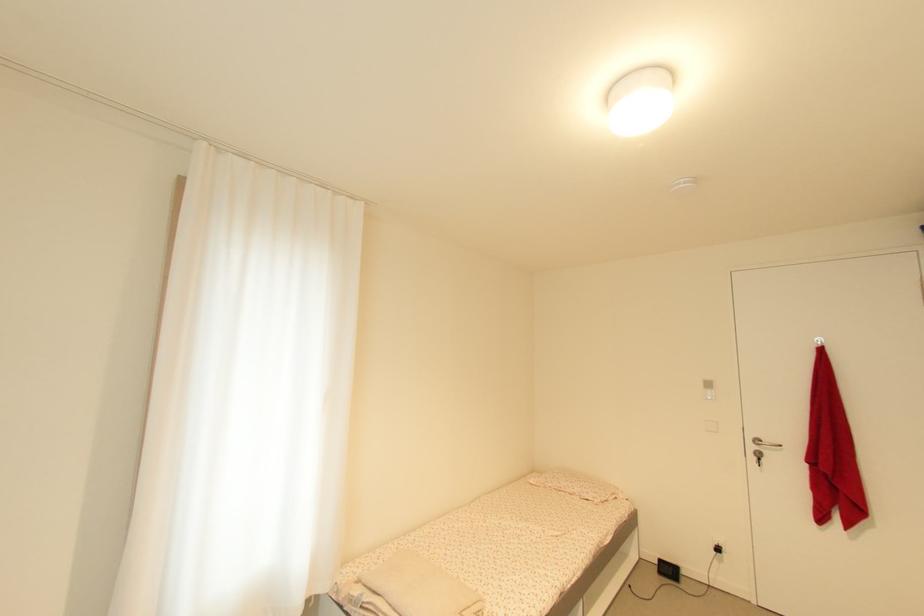
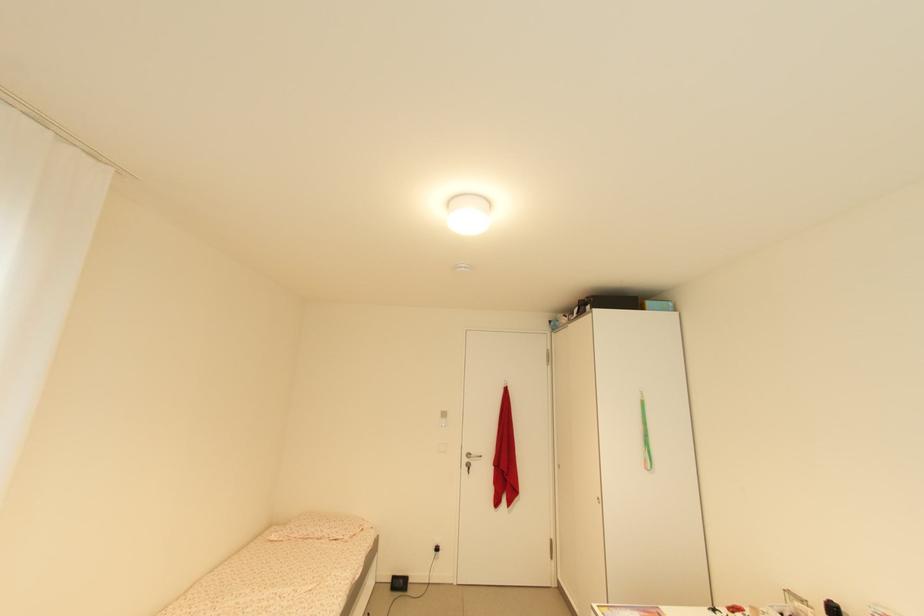
Locate, in the second image, the point that corresponds to (x=581, y=495) in the first image.

(332, 538)